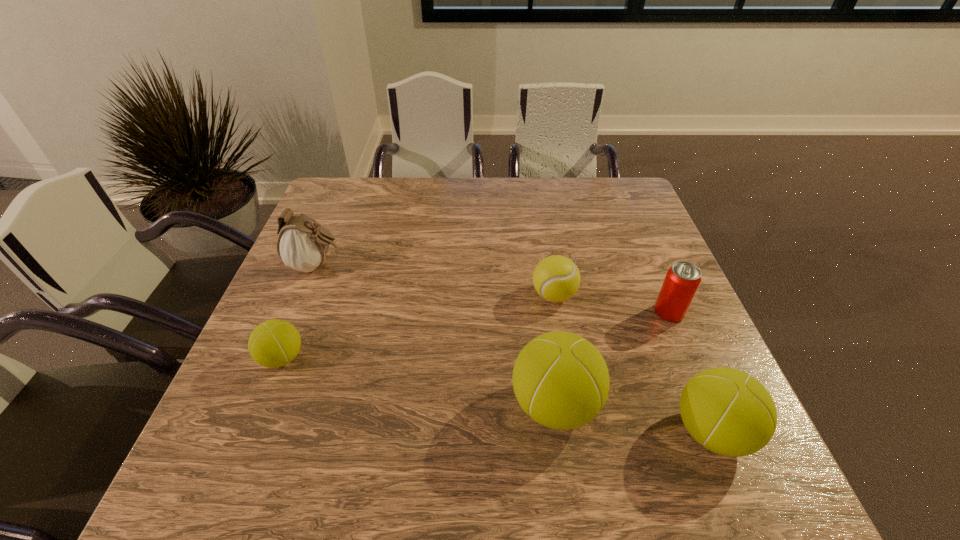
This screenshot has width=960, height=540. I want to click on the leftmost tennis ball, so click(x=274, y=343).

Where is `the rightmost tennis ball`? the rightmost tennis ball is located at coordinates (731, 413).

At what (x,y) coordinates should I click in order to perform the action: click on can. Please return your answer as a coordinate pair (x, y). Looking at the image, I should click on [682, 280].

At what (x,y) coordinates should I click in order to perform the action: click on the farthest tennis ball. Please return your answer as a coordinate pair (x, y). The width and height of the screenshot is (960, 540). Looking at the image, I should click on (556, 278).

Locate an element on the screen. pouch is located at coordinates (302, 245).

Where is `free location located 0.100m on the right of the leftmost tennis ball`? Image resolution: width=960 pixels, height=540 pixels. free location located 0.100m on the right of the leftmost tennis ball is located at coordinates (351, 358).

At what (x,y) coordinates should I click in order to perform the action: click on free location located 0.090m on the back of the rightmost tennis ball. Please return your answer as a coordinate pair (x, y). Looking at the image, I should click on (683, 360).

This screenshot has height=540, width=960. What are the coordinates of `free region located on the back of the can` in the screenshot? It's located at (630, 220).

The width and height of the screenshot is (960, 540). What are the coordinates of `vacant space located 0.230m on the left of the farthest tennis ball` in the screenshot? It's located at (438, 295).

You are a GUI agent. You are given a task and a screenshot of the screen. Output one action in this format:
    pyautogui.click(x=<x>, y=<y>)
    Task: Click on the free space located on the front-facing side of the pouch
    
    Given the screenshot: What is the action you would take?
    pyautogui.click(x=485, y=266)